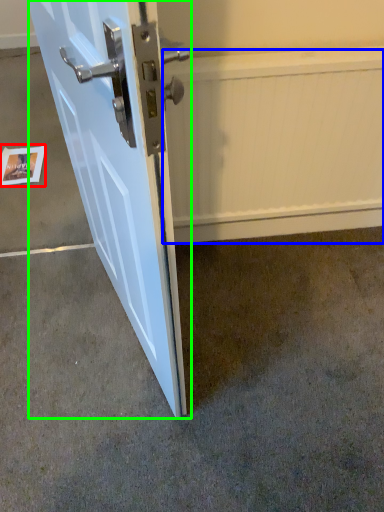
Question: Which object is positioned farthest from postcard (highlighted by a red box)? Select from radiator (highlighted by a blue box) and door (highlighted by a green box).

Choices:
 (A) radiator
 (B) door

Answer: (A)